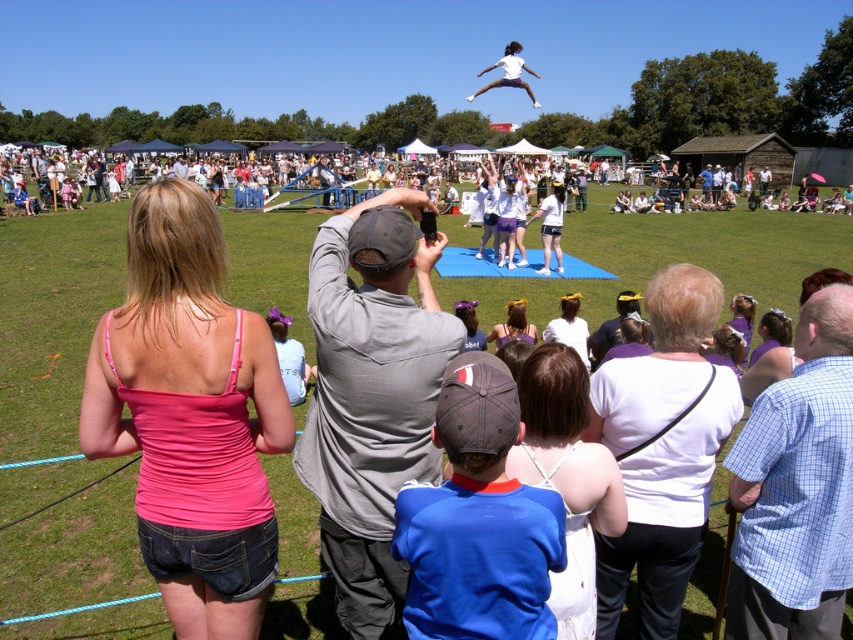
Looking at this image, you are a photographer at the event and want to capture a photo that includes both the white cotton shirt at center and the matte purple dress at center. Which object should you focus on first to ensure both are in frame?

→ You should focus on the white cotton shirt at center first because it is much taller than the matte purple dress at center, so adjusting the camera angle to include its height will naturally include the shorter matte purple dress at center as well.

You are a photographer positioned at the edge of the field. You want to capture a photo that includes the white fabric headband at center. Based on its position, where should you aim your camera to ensure it is in the frame?

To capture the white fabric headband at center, aim your camera at the point with coordinates 0.511 on the x axis and 0.667 on the y axis, as that is where its 2D location is positioned.

You are a photographer at the event and need to capture a clear shot of both the white fabric headband at center and the matte purple dress at center. Based on their positions, which one is higher in the frame?

The white fabric headband at center is above the matte purple dress at center, so it is higher in the frame.